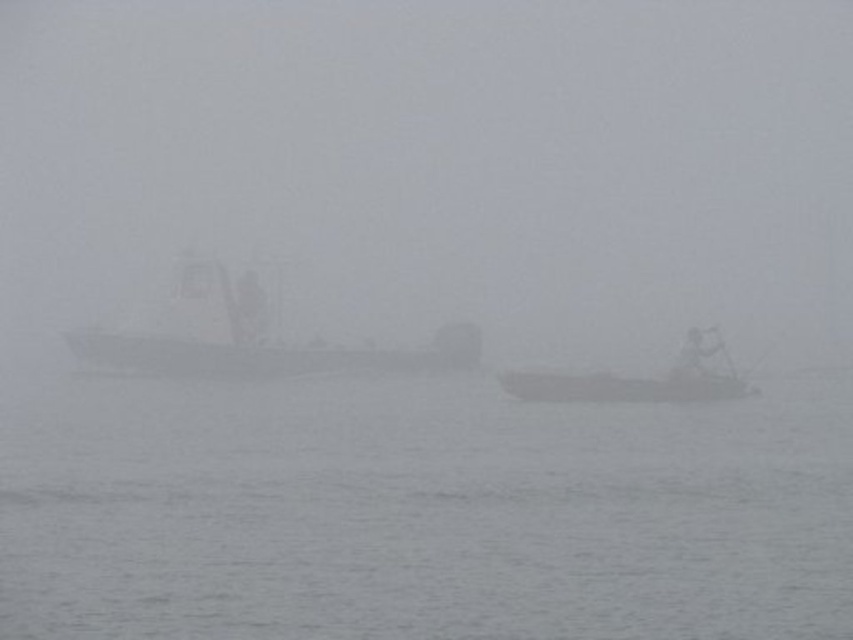
Does gray water at center have a lesser height compared to smooth gray boat at center?

Correct, gray water at center is not as tall as smooth gray boat at center.

Does point (640, 540) come behind point (416, 369)?

No, it is not.

Locate an element on the screen. This screenshot has height=640, width=853. gray water at center is located at coordinates (421, 513).

Is foggy gray sea at center smaller than smooth white boat at center?

Incorrect, foggy gray sea at center is not smaller in size than smooth white boat at center.

Can you confirm if foggy gray sea at center is taller than smooth white boat at center?

Yes, foggy gray sea at center is taller than smooth white boat at center.

Does point (672, 212) come behind point (659, 397)?

Yes.

I want to click on foggy gray sea at center, so (x=442, y=163).

Based on the photo, is foggy gray sea at center closer to the viewer compared to smooth gray boat at center?

No.

Is foggy gray sea at center to the right of smooth gray boat at center from the viewer's perspective?

Correct, you'll find foggy gray sea at center to the right of smooth gray boat at center.

What do you see at coordinates (442, 163) in the screenshot? I see `foggy gray sea at center` at bounding box center [442, 163].

Locate an element on the screen. foggy gray sea at center is located at coordinates (442, 163).